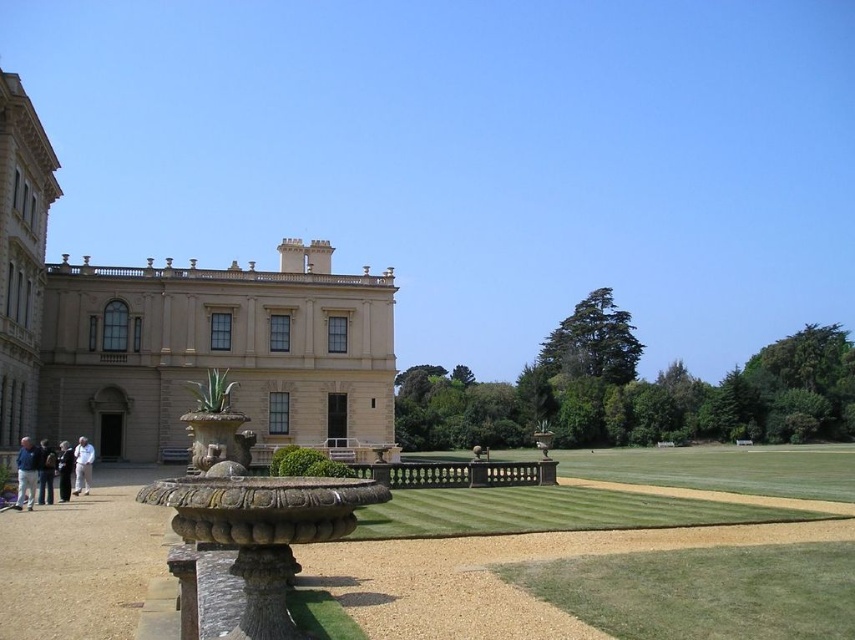
Measure the distance from stone fountain at center to light blue denim jacket at lower left.

A distance of 19.57 meters exists between stone fountain at center and light blue denim jacket at lower left.

Which is more to the right, stone fountain at center or light blue denim jacket at lower left?

Positioned to the right is stone fountain at center.

Between point (215, 477) and point (25, 470), which one is positioned behind?

Positioned behind is point (25, 470).

Image resolution: width=855 pixels, height=640 pixels. Find the location of `stone fountain at center`. stone fountain at center is located at coordinates coord(246,518).

Is the position of beige stone palace at left more distant than that of white cotton shirt at lower left?

Yes, beige stone palace at left is behind white cotton shirt at lower left.

Is point (354, 356) positioned behind point (74, 490)?

That is True.

What do you see at coordinates (178, 333) in the screenshot? The width and height of the screenshot is (855, 640). I see `beige stone palace at left` at bounding box center [178, 333].

What are the coordinates of `beige stone palace at left` in the screenshot? It's located at click(178, 333).

Does beige stone palace at left have a lesser width compared to light blue jeans at lower left?

Incorrect, beige stone palace at left's width is not less than light blue jeans at lower left's.

Looking at this image, can you confirm if beige stone palace at left is taller than light blue jeans at lower left?

Indeed, beige stone palace at left has a greater height compared to light blue jeans at lower left.

Which is in front, point (230, 352) or point (66, 452)?

Point (66, 452) is in front.

The image size is (855, 640). In order to click on beige stone palace at left in this screenshot , I will do `click(178, 333)`.